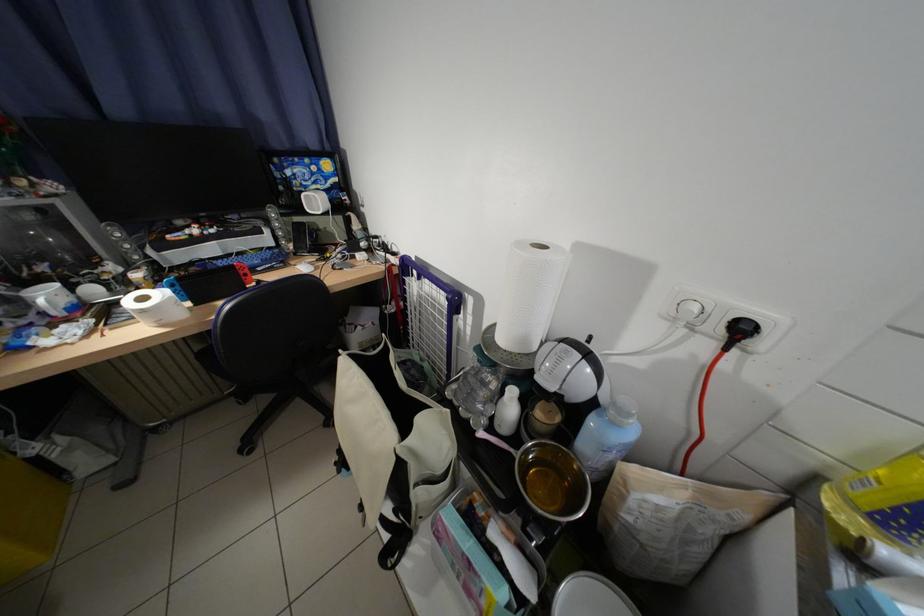
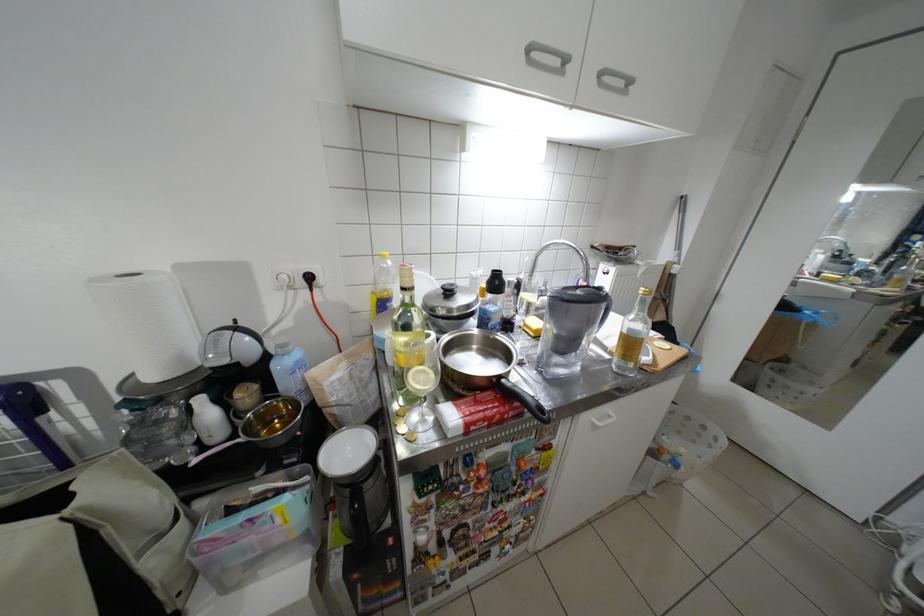
Question: How did the camera likely rotate?

Choices:
 (A) Left
 (B) Right
 (C) Up
 (D) Down

Answer: (B)